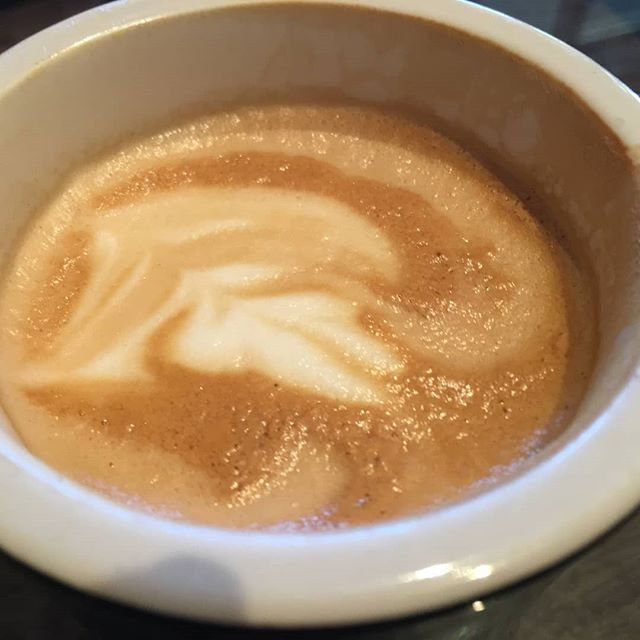
What are the coordinates of `lip of cup` in the screenshot? It's located at (477, 544).